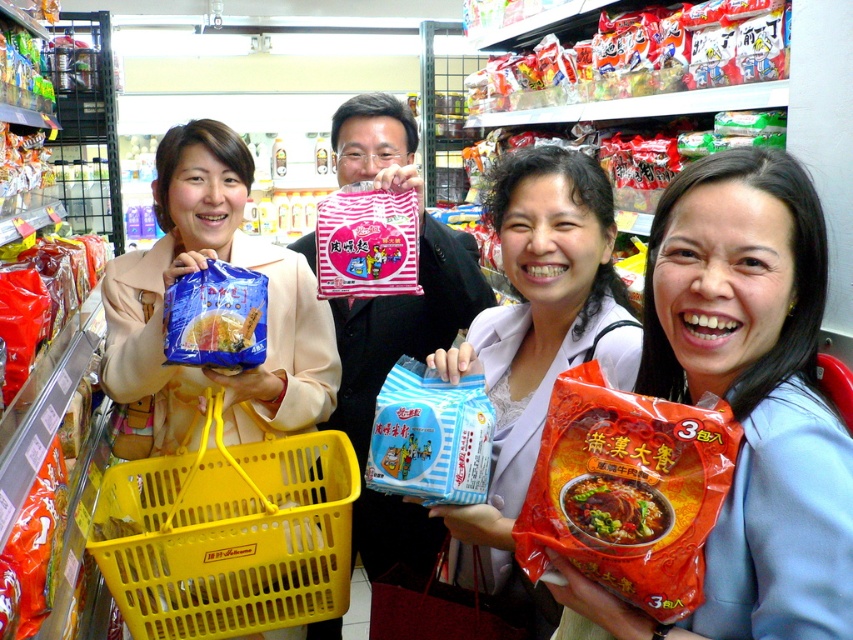
Question: Which of the following is the farthest from the observer?

Choices:
 (A) red glossy instant noodles at center
 (B) matte plastic bag at center

Answer: (B)

Question: Which point is closer to the camera taking this photo?

Choices:
 (A) (715, 371)
 (B) (132, 372)

Answer: (A)

Question: Which object is positioned closest to the matte blue plastic bag at center?

Choices:
 (A) blue matte bag of noodles at center
 (B) matte plastic bag at center

Answer: (A)

Question: Does matte orange snack bag at center lie behind red glossy instant noodles at center?

Choices:
 (A) no
 (B) yes

Answer: (A)

Question: Does red glossy instant noodles at center lie behind blue matte bag of noodles at center?

Choices:
 (A) no
 (B) yes

Answer: (A)

Question: Can you confirm if matte orange snack bag at center is positioned to the left of blue matte bag of noodles at center?

Choices:
 (A) yes
 (B) no

Answer: (B)